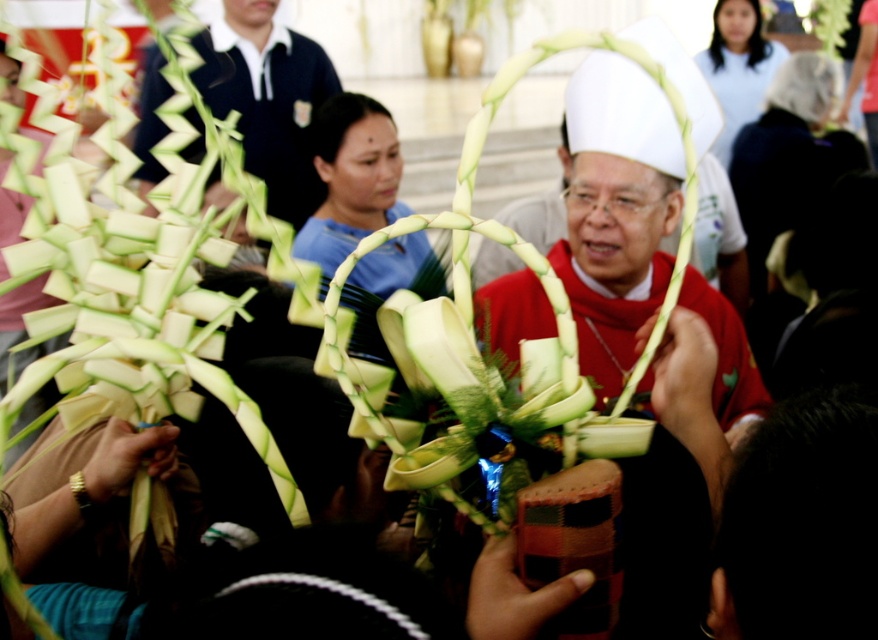
Does white matte hat at center have a greater height compared to matte black polo shirt at upper left?

No, white matte hat at center is not taller than matte black polo shirt at upper left.

Between point (484, 307) and point (252, 84), which one is positioned behind?

The point (252, 84) is more distant.

At what (x,y) coordinates should I click in order to perform the action: click on white matte hat at center. Please return your answer as a coordinate pair (x, y). The height and width of the screenshot is (640, 878). Looking at the image, I should click on (616, 248).